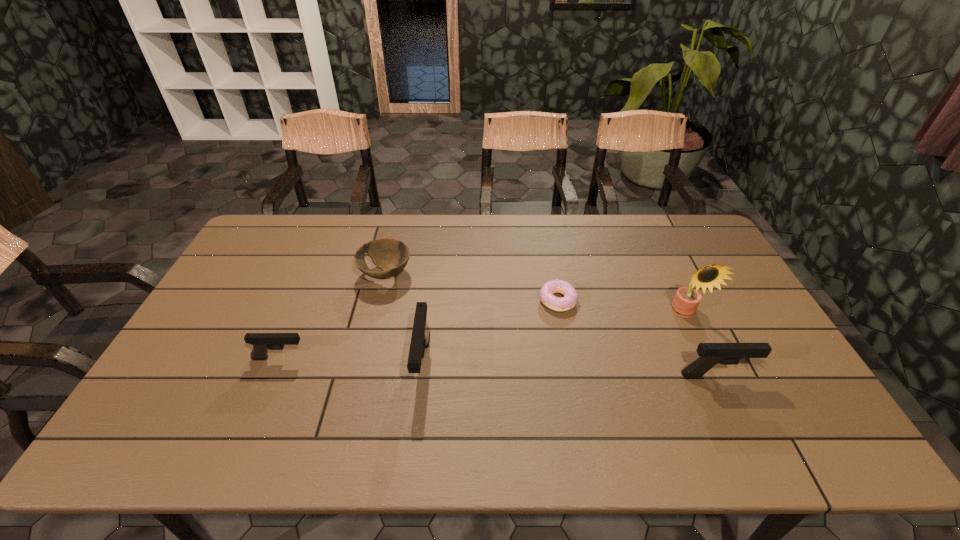
Where is `the shortest pistol`? The image size is (960, 540). the shortest pistol is located at coordinates (261, 342).

Where is `the leftmost object`? Image resolution: width=960 pixels, height=540 pixels. the leftmost object is located at coordinates (261, 342).

You are a GUI agent. You are given a task and a screenshot of the screen. Output one action in this format:
    pyautogui.click(x=<x>, y=<y>)
    Task: Click on the tallest pistol
    The width and height of the screenshot is (960, 540).
    Given the screenshot: What is the action you would take?
    pyautogui.click(x=420, y=337)

Find the location of a particular element. The height and width of the screenshot is (540, 960). the fourth object from right to left is located at coordinates (420, 337).

Where is `the rightmost pistol`? The width and height of the screenshot is (960, 540). the rightmost pistol is located at coordinates (710, 354).

Image resolution: width=960 pixels, height=540 pixels. I want to click on the second shortest pistol, so click(x=710, y=354).

Identify the location of the tallest object. This screenshot has width=960, height=540. (685, 303).

Find the location of `bowl`. bowl is located at coordinates 391,255.

Locate an element on the screen. The height and width of the screenshot is (540, 960). the shortest object is located at coordinates (546, 296).

Image resolution: width=960 pixels, height=540 pixels. Identify the location of the fourth object from left to right. (546, 296).